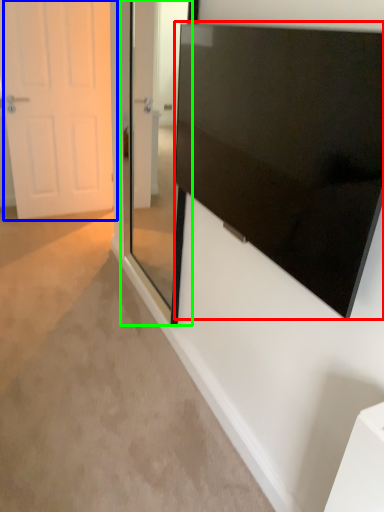
Question: Which is nearer to the screen (highlighted by a red box)? door (highlighted by a blue box) or glass door (highlighted by a green box).

Choices:
 (A) door
 (B) glass door

Answer: (B)